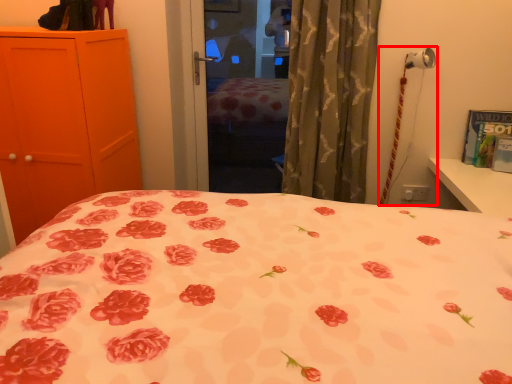
Question: From the image's perspective, what is the correct spatial positioning of table lamp (annotated by the red box) in reference to curtain?

Choices:
 (A) above
 (B) below

Answer: (B)